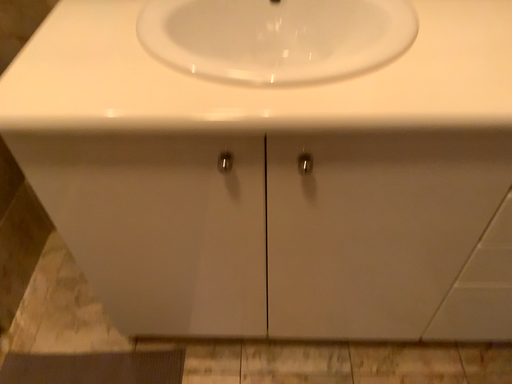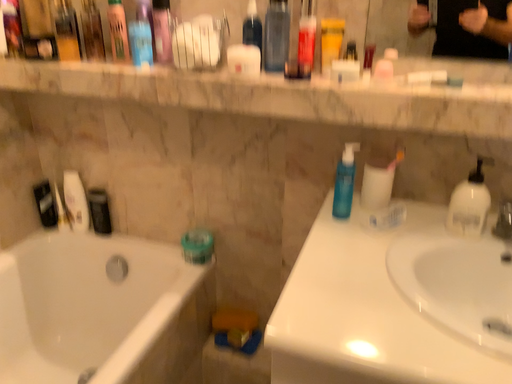
Question: Which way did the camera rotate in the video?

Choices:
 (A) rotated right
 (B) rotated left

Answer: (B)